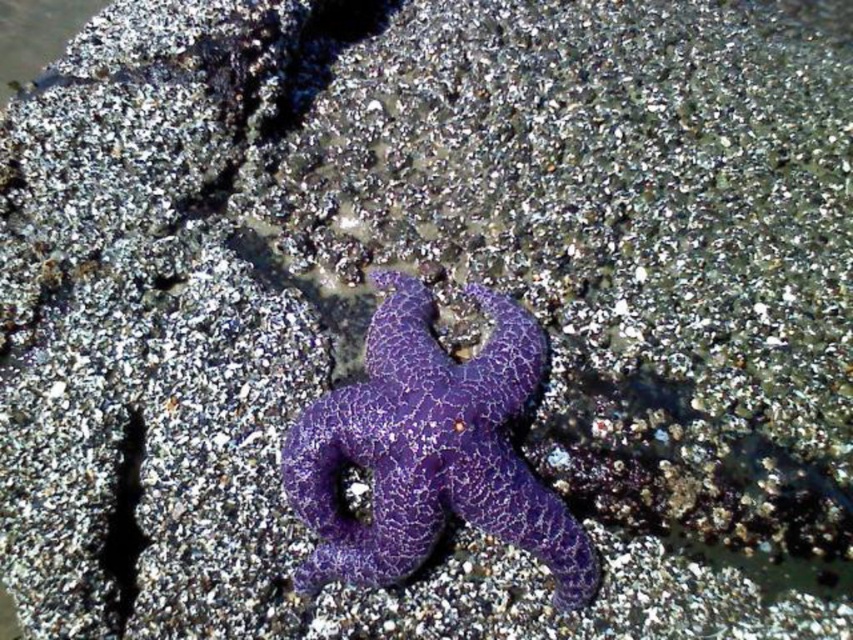
Does purple cracked starfish at center appear over clear water at upper left?

No.

Does point (572, 552) come farther from viewer compared to point (54, 12)?

That is False.

You are a GUI agent. You are given a task and a screenshot of the screen. Output one action in this format:
    pyautogui.click(x=<x>, y=<y>)
    Task: Click on the purple cracked starfish at center
    
    Given the screenshot: What is the action you would take?
    pyautogui.click(x=430, y=451)